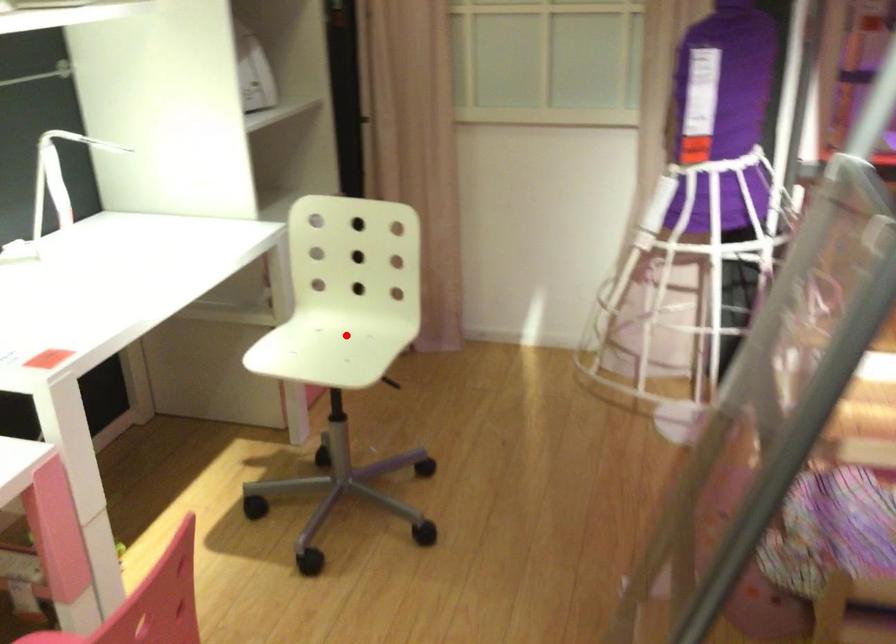
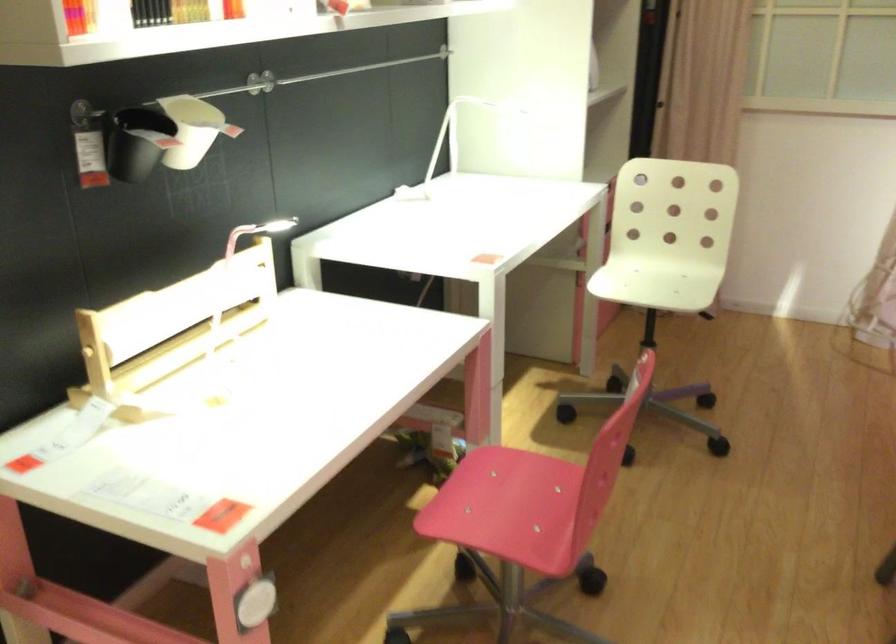
Question: I am providing you with two images of the same scene from different viewpoints. Given a red point in image1, look at the same physical point in image2. Is it:

Choices:
 (A) Closer to the viewpoint
 (B) Farther from the viewpoint

Answer: (B)